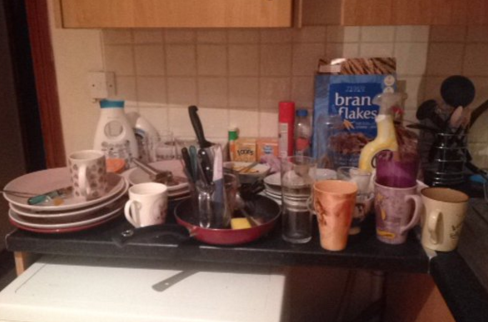
Where is `utensil holder`? utensil holder is located at coordinates (438, 174).